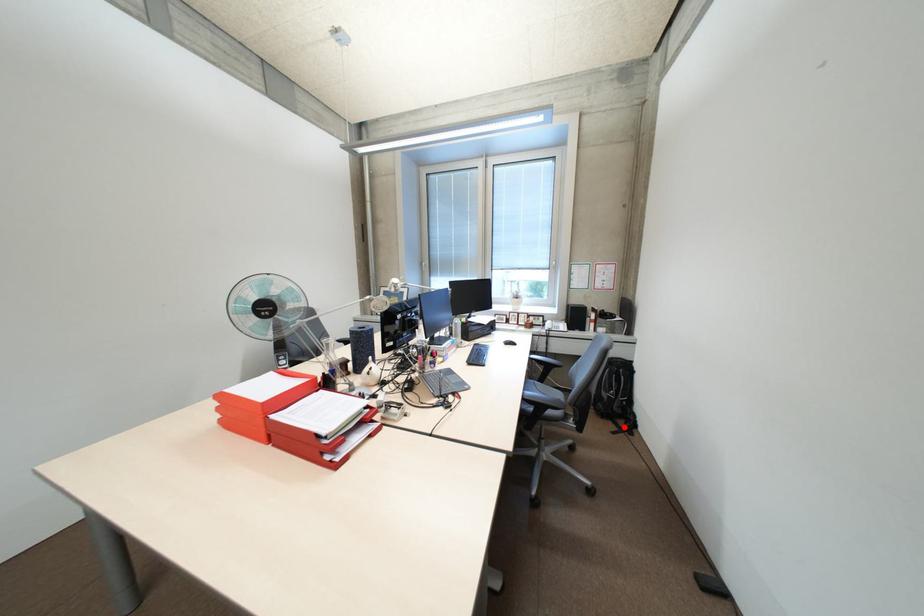
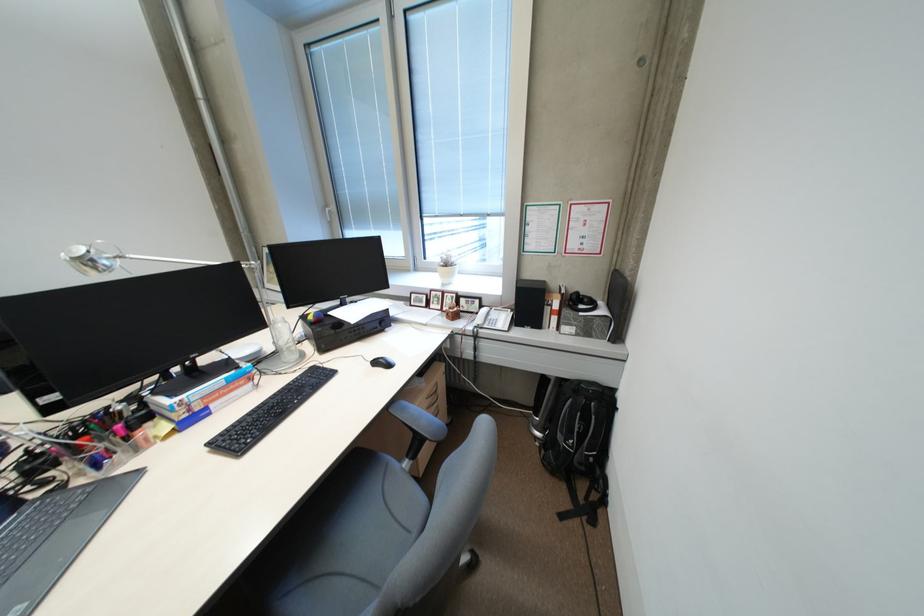
Question: I am providing you with two images of the same scene from different viewpoints. Given a red point in image1, look at the same physical point in image2. Is it:

Choices:
 (A) Closer to the viewpoint
 (B) Farther from the viewpoint

Answer: (A)